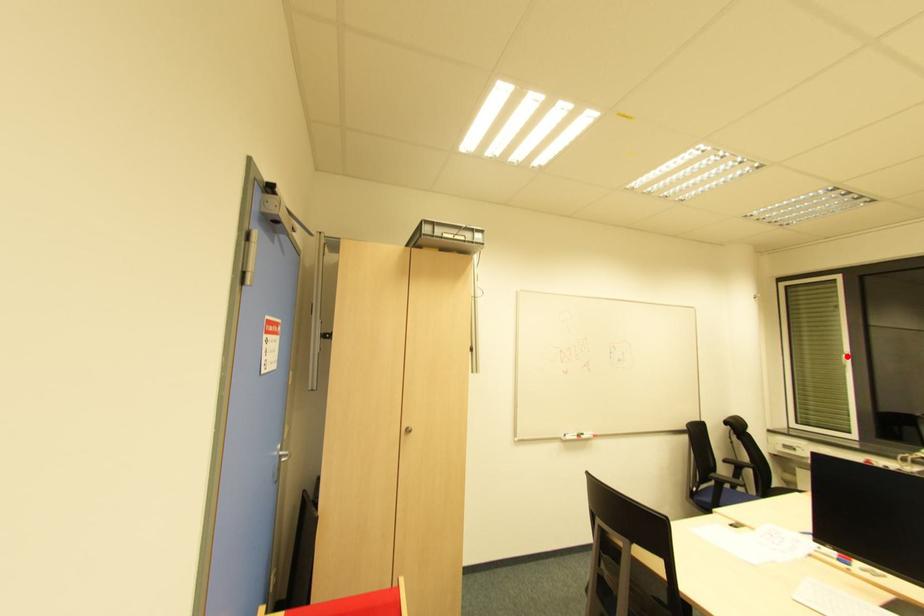
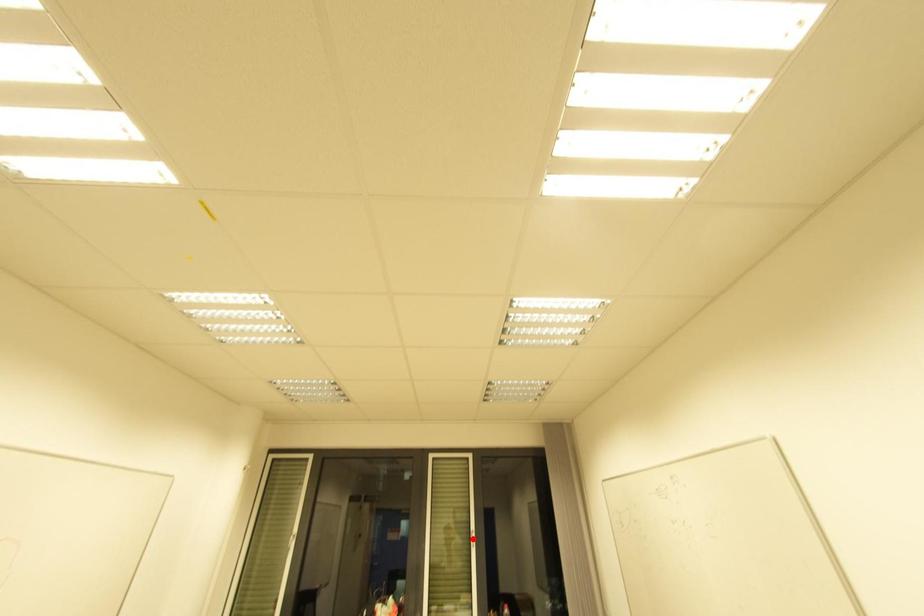
I am providing you with two images of the same scene from different viewpoints. A red point is marked on the first image and another point is marked on the second image. Are the points marked in image1 and image2 representing the same 3D position?

No